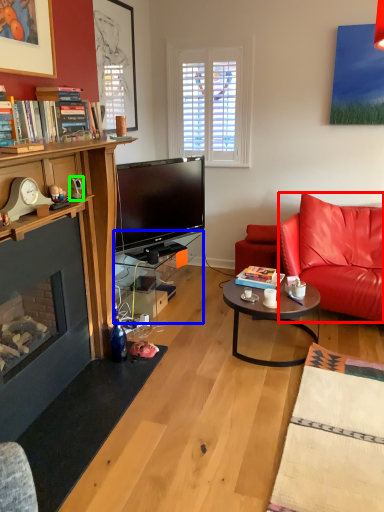
Question: Considering the real-world distances, which object is farthest from cushion (highlighted by a red box)? table (highlighted by a blue box) or corded phone (highlighted by a green box)?

Choices:
 (A) table
 (B) corded phone

Answer: (B)